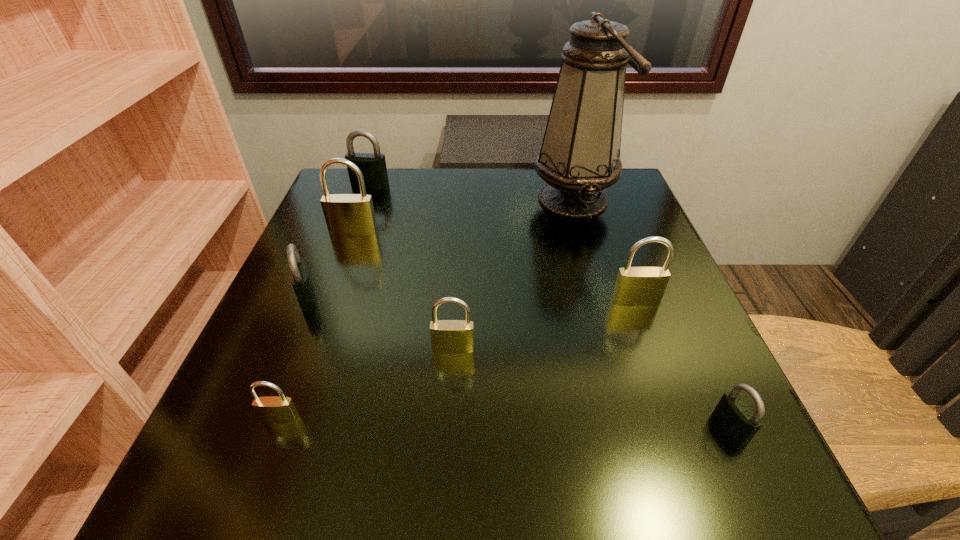
Locate an element on the screen. This screenshot has width=960, height=540. the tallest object is located at coordinates (580, 154).

Where is `brown oil lamp`? The image size is (960, 540). brown oil lamp is located at coordinates (580, 154).

At what (x,y) coordinates should I click in order to perform the action: click on the tallest padlock. Please return your answer as a coordinate pair (x, y). The width and height of the screenshot is (960, 540). Looking at the image, I should click on (345, 214).

The image size is (960, 540). In order to click on the sixth nearest padlock in this screenshot , I will do `click(345, 214)`.

I want to click on the biggest black padlock, so click(x=373, y=167).

Where is `the farthest padlock`? the farthest padlock is located at coordinates (373, 167).

Find the location of `the second padlock from right to left`. the second padlock from right to left is located at coordinates (635, 286).

At what (x,y) coordinates should I click in order to perform the action: click on the rightmost brass padlock. Please return your answer as a coordinate pair (x, y). This screenshot has width=960, height=540. Looking at the image, I should click on (635, 286).

Find the location of `the second biggest black padlock`. the second biggest black padlock is located at coordinates (300, 279).

Locate an element on the screen. the third brass padlock from left to right is located at coordinates (447, 336).